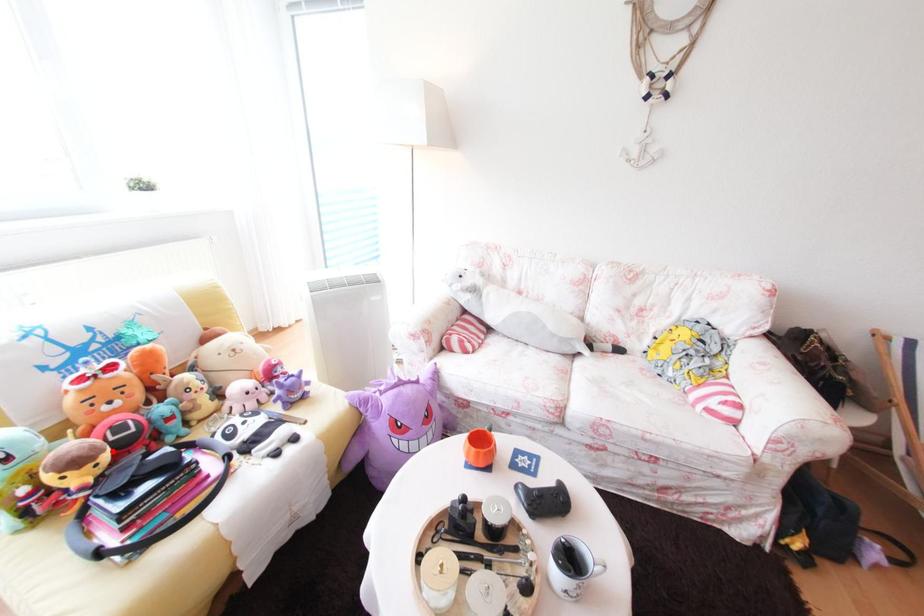
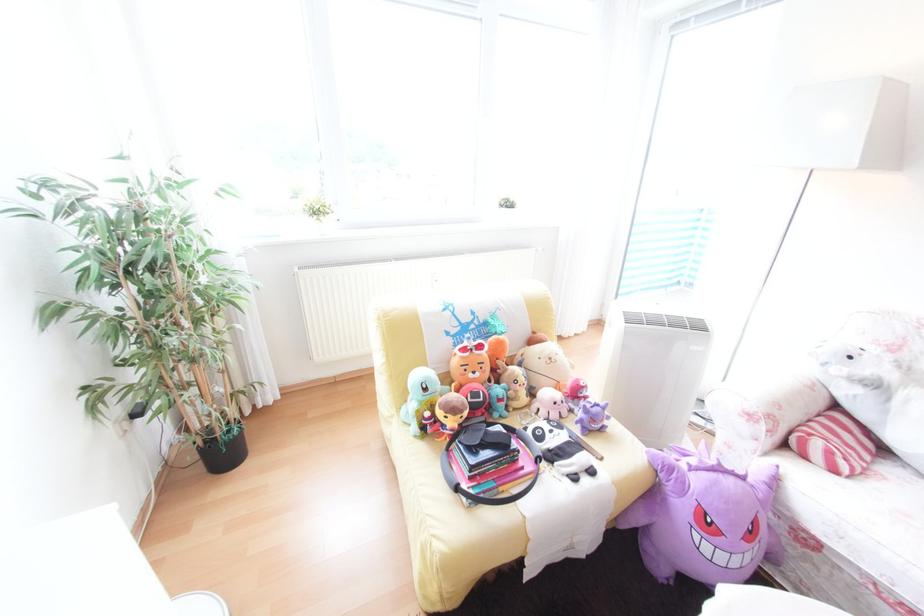
Locate, in the second image, the point that corresponds to the highlighted location in the first image.

(476, 408)